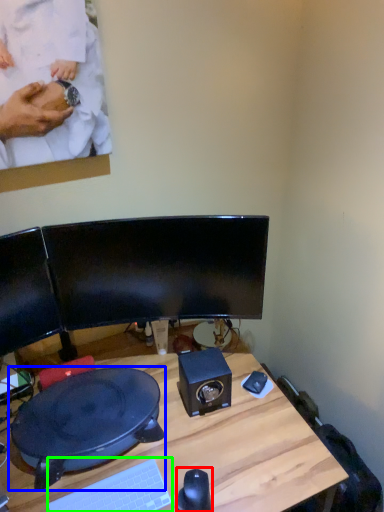
Question: Considering the real-world distances, which object is closest to mouse (highlighted by a red box)? sit (highlighted by a blue box) or computer keyboard (highlighted by a green box).

Choices:
 (A) sit
 (B) computer keyboard

Answer: (B)